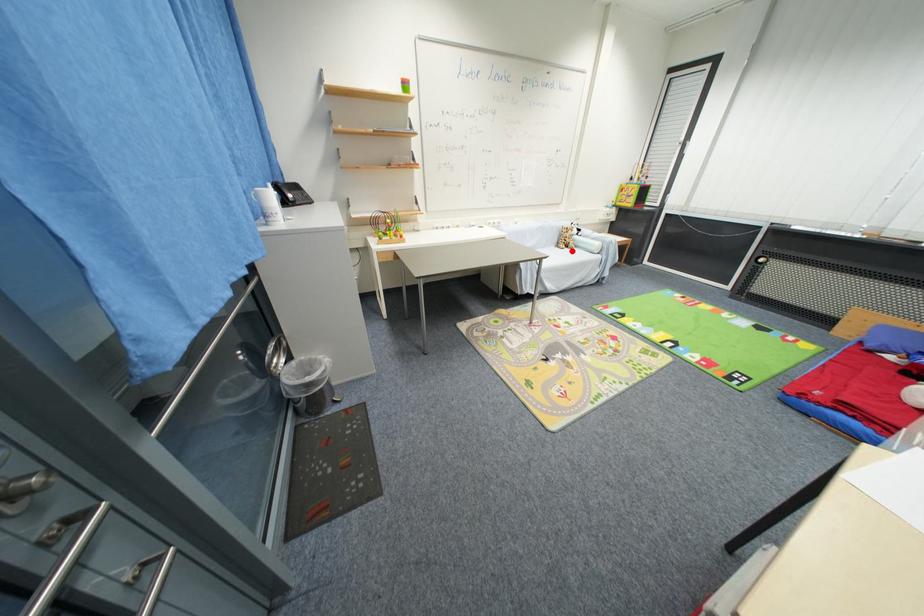
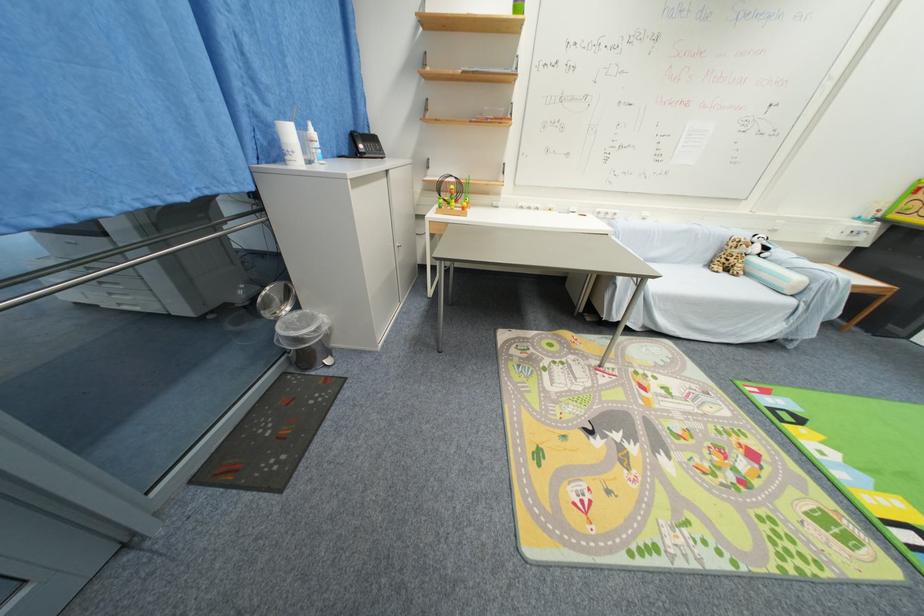
Question: I am providing you with two images of the same scene from different viewpoints. Image1 has a red point marked. In image2, the corresponding 3D location appears at what relative position? Reply with the corresponding letter.

Choices:
 (A) Closer
 (B) Farther

Answer: (A)